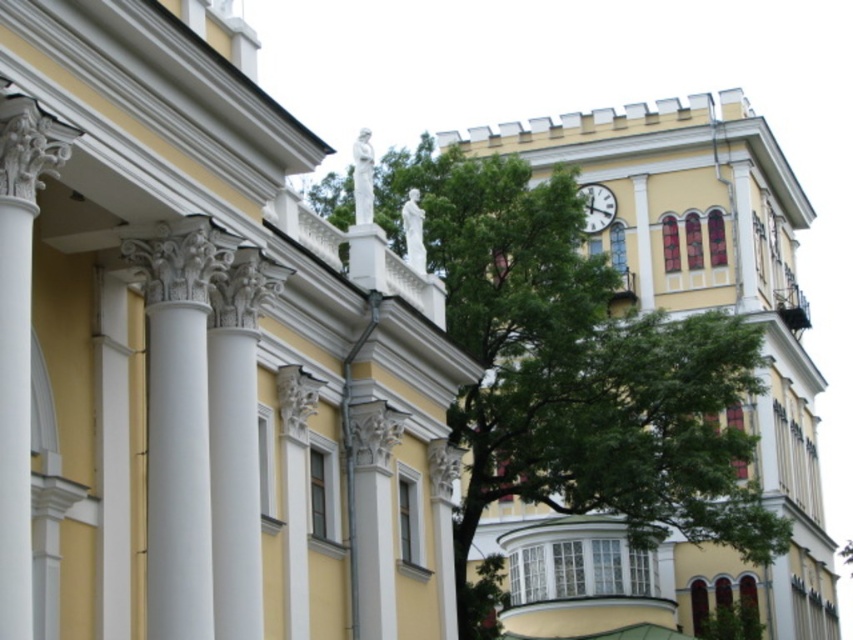
You are an architect examining the classical building. You notice the white marble columns at upper left and the white marble column at left. Which of these two columns is bigger in size?

The white marble columns at upper left is larger in size than the white marble column at left.

You are an architect reviewing a building design. You notice the green leafy tree at upper center and the white glossy clock at upper center. Which object occupies more horizontal space in the design?

The green leafy tree at upper center occupies more horizontal space than the white glossy clock at upper center because its width surpasses the clock.

You are standing in front of the classical building and want to determine the relative positions of two points marked on the facade. According to the image, which point is closer to you, point (30, 275) or point (601, 204)?

Point (30, 275) is closer to the viewer than point (601, 204).